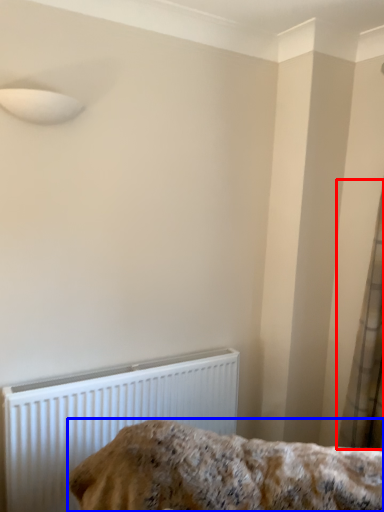
Question: Which of the following is the closest to the observer, curtain (highlighted by a red box) or furniture (highlighted by a blue box)?

Choices:
 (A) curtain
 (B) furniture

Answer: (B)